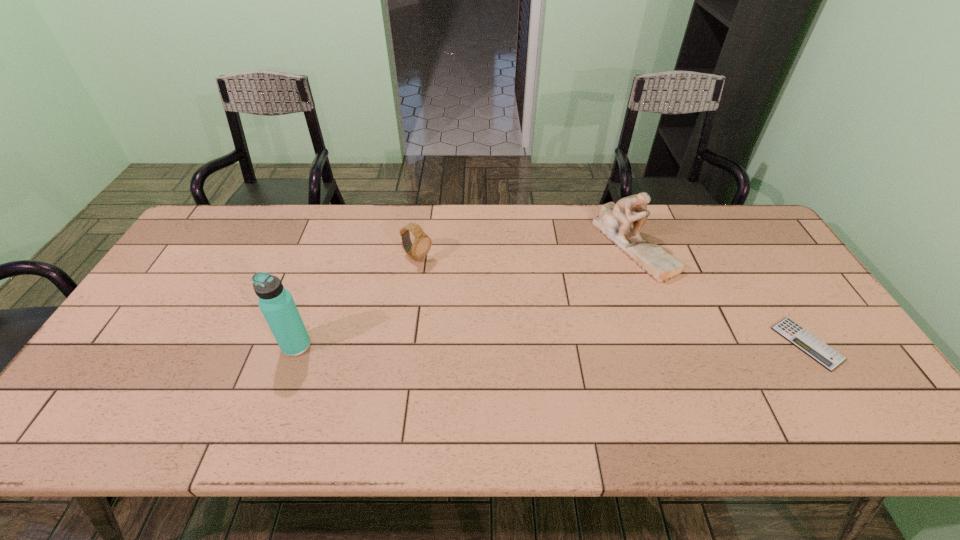
The height and width of the screenshot is (540, 960). I want to click on vacant area between the shortest object and the second object from left to right, so click(612, 301).

At what (x,y) coordinates should I click in order to perform the action: click on vacant point located between the rightmost object and the second object from right to left. Please return your answer as a coordinate pair (x, y). The image size is (960, 540). Looking at the image, I should click on (720, 294).

Where is `free area in between the shortest object and the figurine`? The image size is (960, 540). free area in between the shortest object and the figurine is located at coordinates (720, 294).

At what (x,y) coordinates should I click in order to perform the action: click on free space between the watch and the calculator. Please return your answer as a coordinate pair (x, y). Looking at the image, I should click on (612, 301).

The height and width of the screenshot is (540, 960). In order to click on unoccupied area between the tallest object and the shortest object in this screenshot , I will do `click(552, 345)`.

At what (x,y) coordinates should I click in order to perform the action: click on free space between the second object from right to left and the second object from left to right. Please return your answer as a coordinate pair (x, y). Looking at the image, I should click on (525, 252).

You are a GUI agent. You are given a task and a screenshot of the screen. Output one action in this format:
    pyautogui.click(x=<x>, y=<y>)
    Task: Click on the free spot between the rightmost object and the second tallest object
    This screenshot has height=540, width=960.
    Given the screenshot: What is the action you would take?
    pyautogui.click(x=720, y=294)

Locate an element on the screen. The height and width of the screenshot is (540, 960). vacant space in between the watch and the calculator is located at coordinates (612, 301).

You are a GUI agent. You are given a task and a screenshot of the screen. Output one action in this format:
    pyautogui.click(x=<x>, y=<y>)
    Task: Click on the object that stands as the second closest to the shortest object
    The image size is (960, 540).
    Given the screenshot: What is the action you would take?
    pyautogui.click(x=420, y=248)

I want to click on object that stands as the third closest to the leftmost object, so click(822, 353).